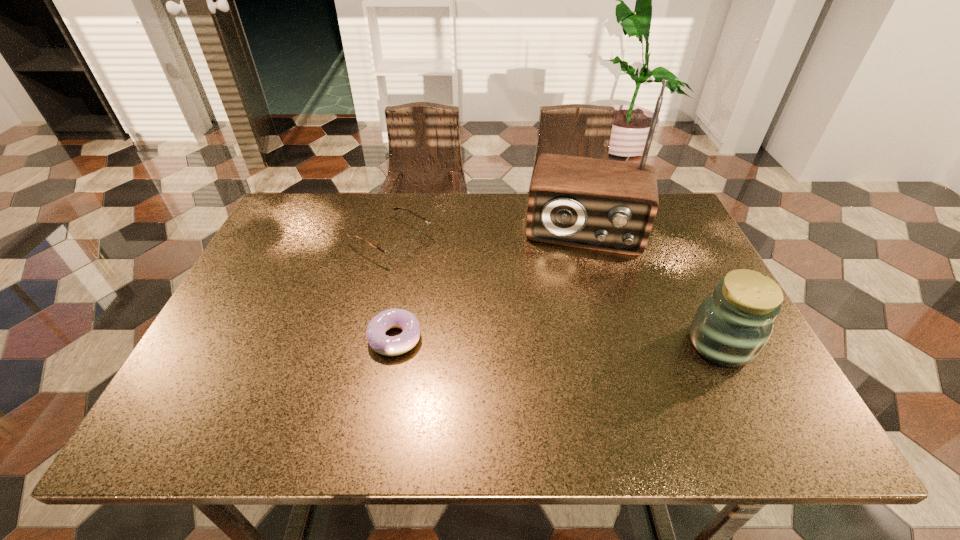
In order to click on vacant space located 0.380m on the front-facing side of the third tallest object in this screenshot , I will do `click(538, 323)`.

Find the location of a particular element. Image resolution: width=960 pixels, height=540 pixels. vacant point located 0.340m on the front-facing side of the third tallest object is located at coordinates (523, 315).

Identify the location of radio receiver that is at the far edge. The height and width of the screenshot is (540, 960). (606, 205).

This screenshot has height=540, width=960. What are the coordinates of `spectacles that is at the far edge` in the screenshot? It's located at (398, 252).

The height and width of the screenshot is (540, 960). Find the location of `object at the near edge`. object at the near edge is located at coordinates (731, 326).

You are a GUI agent. You are given a task and a screenshot of the screen. Output one action in this format:
    pyautogui.click(x=<x>, y=<y>)
    Task: Click on the jar that is at the right edge
    The width and height of the screenshot is (960, 540).
    Given the screenshot: What is the action you would take?
    pyautogui.click(x=731, y=326)

The width and height of the screenshot is (960, 540). What are the coordinates of `radio receiver located in the right edge section of the desktop` in the screenshot? It's located at (606, 205).

You are a GUI agent. You are given a task and a screenshot of the screen. Output one action in this format:
    pyautogui.click(x=<x>, y=<y>)
    Task: Click on the object that is at the far right corner
    The width and height of the screenshot is (960, 540).
    Given the screenshot: What is the action you would take?
    pyautogui.click(x=606, y=205)

Locate an element on the screen. The height and width of the screenshot is (540, 960). object at the near right corner is located at coordinates (731, 326).

Identify the location of vacant area at the far edge. The height and width of the screenshot is (540, 960). (382, 225).